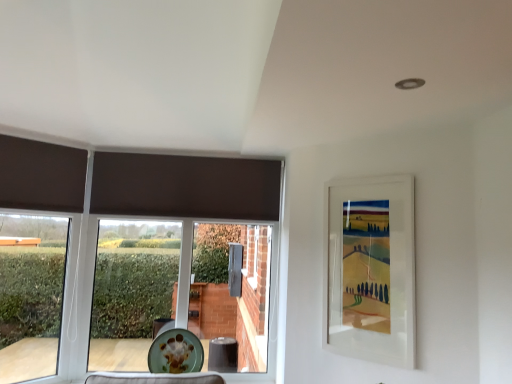
Question: From the image's perspective, is green glazed plate at lower center over white matte picture frame at upper right?

Choices:
 (A) no
 (B) yes

Answer: (A)

Question: Can you confirm if green glazed plate at lower center is bigger than white matte picture frame at upper right?

Choices:
 (A) yes
 (B) no

Answer: (B)

Question: Can you confirm if green glazed plate at lower center is positioned to the right of white matte picture frame at upper right?

Choices:
 (A) no
 (B) yes

Answer: (A)

Question: Is green glazed plate at lower center at the left side of white matte picture frame at upper right?

Choices:
 (A) yes
 (B) no

Answer: (A)

Question: Could you tell me if green glazed plate at lower center is turned towards white matte picture frame at upper right?

Choices:
 (A) no
 (B) yes

Answer: (A)

Question: From a real-world perspective, relative to green glazed plate at lower center, is white matte picture frame at upper right vertically above or below?

Choices:
 (A) below
 (B) above

Answer: (B)

Question: Based on their positions, is white matte picture frame at upper right located to the left or right of green glazed plate at lower center?

Choices:
 (A) right
 (B) left

Answer: (A)

Question: Is white matte picture frame at upper right inside or outside of green glazed plate at lower center?

Choices:
 (A) outside
 (B) inside

Answer: (A)

Question: Considering the positions of white matte picture frame at upper right and green glazed plate at lower center in the image, is white matte picture frame at upper right wider or thinner than green glazed plate at lower center?

Choices:
 (A) wide
 (B) thin

Answer: (B)

Question: From a real-world perspective, is matte brown curtain at left physically located above or below white matte picture frame at upper right?

Choices:
 (A) above
 (B) below

Answer: (B)

Question: Based on their positions, is matte brown curtain at left located to the left or right of white matte picture frame at upper right?

Choices:
 (A) left
 (B) right

Answer: (A)

Question: From the image's perspective, is matte brown curtain at left positioned above or below white matte picture frame at upper right?

Choices:
 (A) below
 (B) above

Answer: (A)

Question: Considering their positions, is matte brown curtain at left located in front of or behind white matte picture frame at upper right?

Choices:
 (A) behind
 (B) front

Answer: (A)

Question: Visually, is green glazed plate at lower center positioned to the left or to the right of white matte picture frame at upper right?

Choices:
 (A) right
 (B) left

Answer: (B)

Question: Does point (187, 367) appear closer or farther from the camera than point (376, 336)?

Choices:
 (A) farther
 (B) closer

Answer: (A)